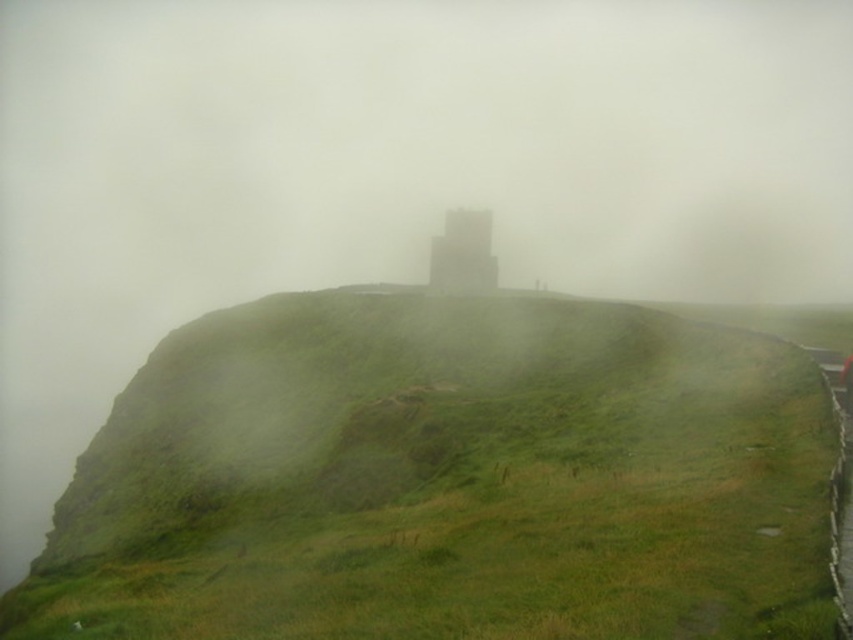
Question: Does green grassy hillside at center have a smaller size compared to gray concrete tower at center?

Choices:
 (A) yes
 (B) no

Answer: (B)

Question: Does green grassy hillside at center appear on the right side of gray concrete tower at center?

Choices:
 (A) no
 (B) yes

Answer: (A)

Question: Can you confirm if green grassy hillside at center is wider than gray concrete tower at center?

Choices:
 (A) yes
 (B) no

Answer: (A)

Question: Which point is closer to the camera?

Choices:
 (A) (466, 621)
 (B) (460, 273)

Answer: (A)